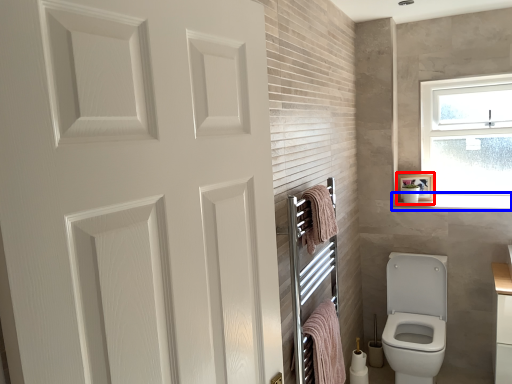
Question: Among these objects, which one is nearest to the camera, medicine cabinet (highlighted by a red box) or window sill (highlighted by a blue box)?

Choices:
 (A) medicine cabinet
 (B) window sill

Answer: (B)